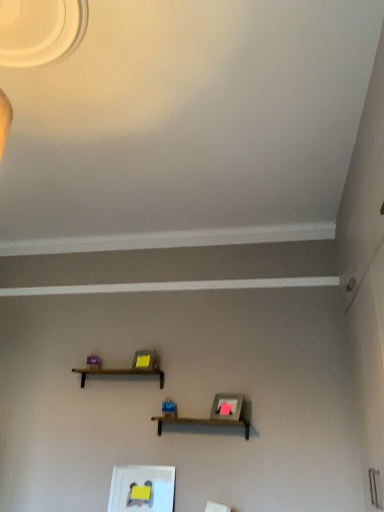
Question: Which is correct: matte white picture frame at lower center is inside brown wooden shelf at center, or outside of it?

Choices:
 (A) inside
 (B) outside

Answer: (B)

Question: Is point (152, 506) positioned closer to the camera than point (137, 373)?

Choices:
 (A) farther
 (B) closer

Answer: (B)

Question: In terms of size, does matte white picture frame at lower center appear bigger or smaller than brown wooden shelf at center?

Choices:
 (A) big
 (B) small

Answer: (B)

Question: Is brown wooden shelf at center inside the boundaries of matte white picture frame at lower center, or outside?

Choices:
 (A) inside
 (B) outside

Answer: (B)

Question: Does point (92, 371) appear closer or farther from the camera than point (152, 501)?

Choices:
 (A) farther
 (B) closer

Answer: (A)

Question: From the image's perspective, is brown wooden shelf at center above or below matte white picture frame at lower center?

Choices:
 (A) below
 (B) above

Answer: (B)

Question: Considering the positions of brown wooden shelf at center and matte white picture frame at lower center in the image, is brown wooden shelf at center taller or shorter than matte white picture frame at lower center?

Choices:
 (A) tall
 (B) short

Answer: (B)